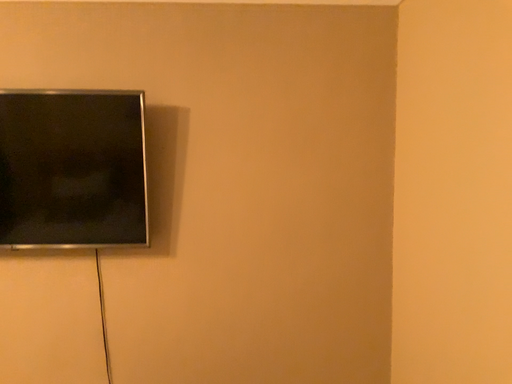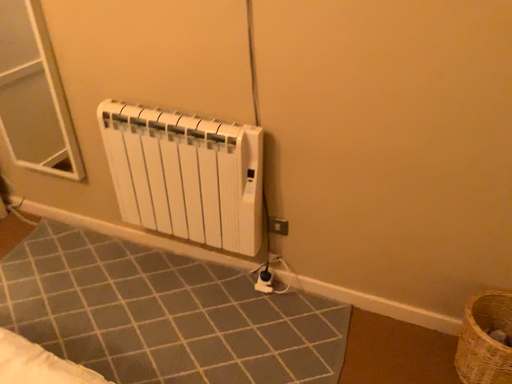
Question: Which way did the camera rotate in the video?

Choices:
 (A) rotated left
 (B) rotated right

Answer: (A)